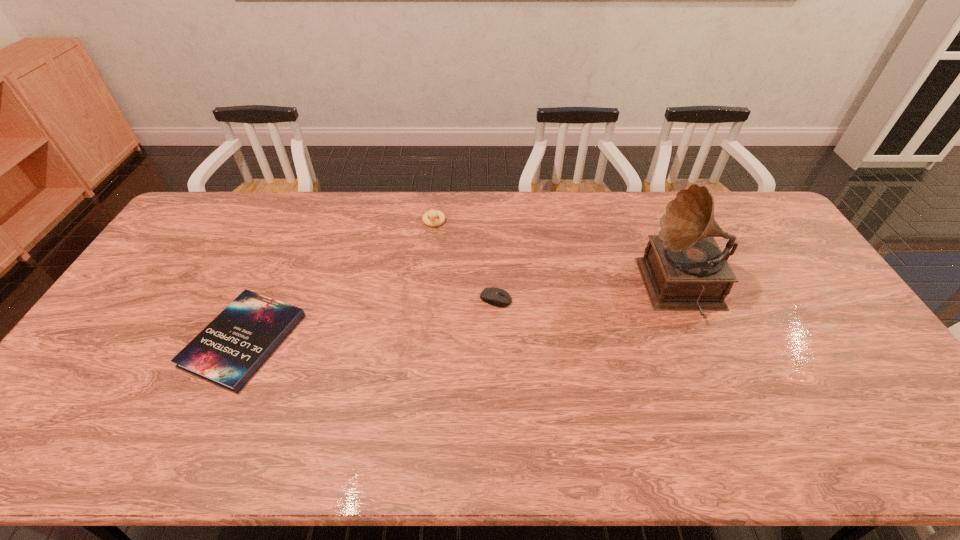
At what (x,y) coordinates should I click in order to perform the action: click on vacant space that satisfies the following two spatial constraints: 1. at the beak of the second tallest object; 2. on the right side of the computer equipment. Please return your answer as a coordinate pair (x, y). Looking at the image, I should click on (425, 299).

The image size is (960, 540). In order to click on free spot that satisfies the following two spatial constraints: 1. on the back side of the shortest object; 2. on the right side of the third object from left to right in this screenshot , I will do `click(262, 299)`.

This screenshot has width=960, height=540. I want to click on vacant point that satisfies the following two spatial constraints: 1. at the beak of the duckling; 2. on the left side of the second object from right to left, so click(425, 299).

Find the location of `vacant space that satisfies the following two spatial constraints: 1. from the horn of the tallest object; 2. on the front side of the shortest object`. vacant space that satisfies the following two spatial constraints: 1. from the horn of the tallest object; 2. on the front side of the shortest object is located at coordinates (705, 340).

This screenshot has height=540, width=960. In order to click on free spot that satisfies the following two spatial constraints: 1. from the horn of the record player; 2. on the front side of the computer equipment in this screenshot , I will do `click(687, 299)`.

Locate an element on the screen. The width and height of the screenshot is (960, 540). vacant area that satisfies the following two spatial constraints: 1. on the back side of the computer equipment; 2. on the right side of the leftmost object is located at coordinates (262, 299).